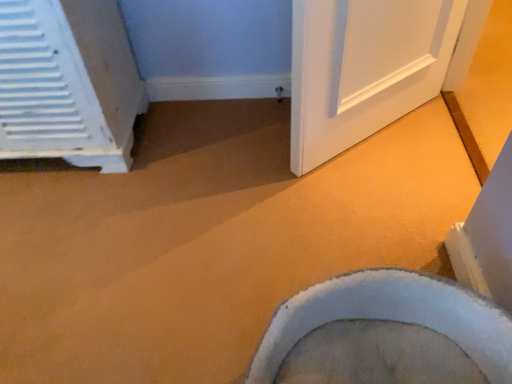
Question: In terms of width, does white soft toilet at lower right look wider or thinner when compared to white plastic radiator at left?

Choices:
 (A) thin
 (B) wide

Answer: (B)

Question: From the image's perspective, relative to white plastic radiator at left, is white soft toilet at lower right above or below?

Choices:
 (A) below
 (B) above

Answer: (A)

Question: Is white soft toilet at lower right bigger or smaller than white plastic radiator at left?

Choices:
 (A) small
 (B) big

Answer: (A)

Question: Considering the relative positions of white plastic radiator at left and white soft toilet at lower right in the image provided, is white plastic radiator at left to the left or to the right of white soft toilet at lower right?

Choices:
 (A) right
 (B) left

Answer: (B)

Question: Is white plastic radiator at left taller or shorter than white soft toilet at lower right?

Choices:
 (A) tall
 (B) short

Answer: (A)

Question: From a real-world perspective, is white plastic radiator at left above or below white soft toilet at lower right?

Choices:
 (A) below
 (B) above

Answer: (B)

Question: From the image's perspective, is white plastic radiator at left located above or below white soft toilet at lower right?

Choices:
 (A) below
 (B) above

Answer: (B)